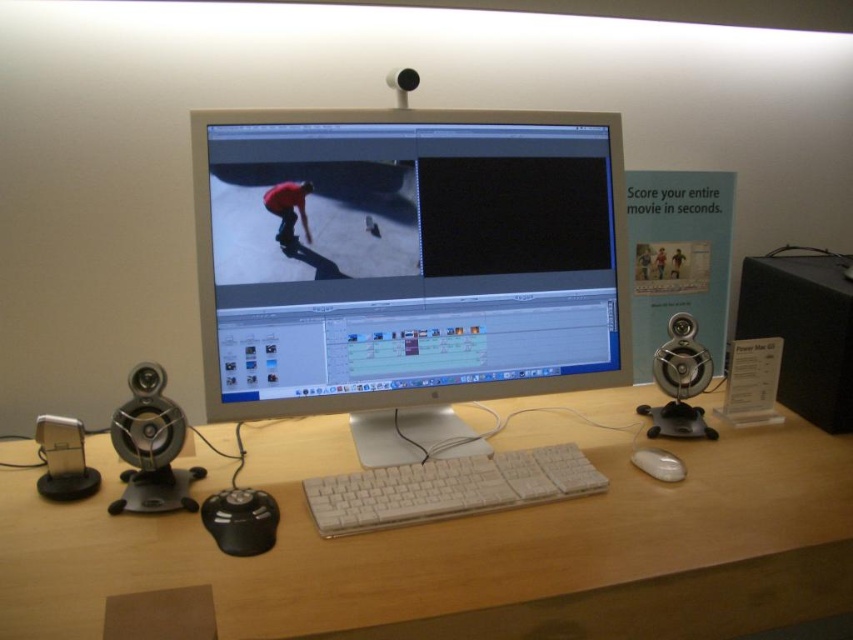
Question: Which point is farther to the camera?

Choices:
 (A) white matte mouse at lower center
 (B) satin silver speaker at left
 (C) white plastic monitor at center
 (D) white wood computer desk at center

Answer: (A)

Question: Can you confirm if white plastic keyboard at center is bigger than white matte mouse at lower center?

Choices:
 (A) yes
 (B) no

Answer: (A)

Question: Which object appears closest to the camera in this image?

Choices:
 (A) white plastic keyboard at center
 (B) white plastic monitor at center
 (C) white wood computer desk at center

Answer: (C)

Question: Does white wood computer desk at center lie in front of white plastic keyboard at center?

Choices:
 (A) yes
 (B) no

Answer: (A)

Question: Which object is positioned farthest from the black matte speaker at right?

Choices:
 (A) white plastic monitor at center
 (B) satin silver speaker at left
 (C) white matte mouse at lower center

Answer: (B)

Question: Is white plastic keyboard at center positioned at the back of black matte speaker at right?

Choices:
 (A) yes
 (B) no

Answer: (B)